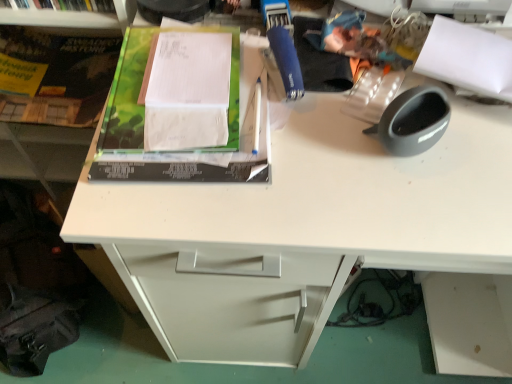
Question: In terms of height, does green matte book at upper left look taller or shorter compared to green matte paper at upper left, the 2th paperback book viewed from the back?

Choices:
 (A) tall
 (B) short

Answer: (A)

Question: From a real-world perspective, relative to green matte paper at upper left, arranged as the 1th paperback book when viewed from the right, is green matte book at upper left vertically above or below?

Choices:
 (A) below
 (B) above

Answer: (A)

Question: Which object is the closest to the green matte book at upper left?

Choices:
 (A) hardcover book at upper left, the second paperback book viewed from the front
 (B) green matte paper at upper left, the second paperback book when ordered from left to right
 (C) white plastic shelf at upper left

Answer: (A)

Question: Which of these objects is positioned farthest from the green matte paper at upper left, marked as the first paperback book in a front-to-back arrangement?

Choices:
 (A) green matte book at upper left
 (B) hardcover book at upper left, the second paperback book viewed from the front
 (C) white plastic shelf at upper left

Answer: (B)